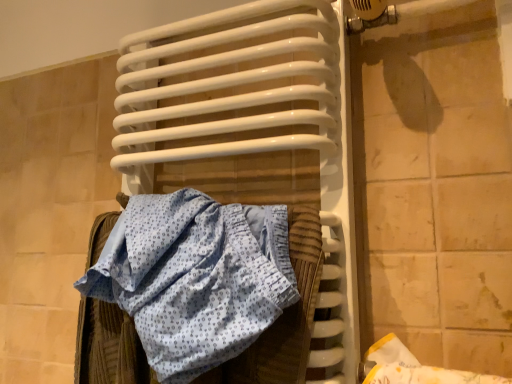
Identify the location of white glossy radiator at center. (251, 132).

What do you see at coordinates (251, 132) in the screenshot? I see `white glossy radiator at center` at bounding box center [251, 132].

In order to click on blue printed fabric at center in this screenshot , I will do `click(183, 285)`.

What do you see at coordinates (183, 285) in the screenshot? The width and height of the screenshot is (512, 384). I see `blue printed fabric at center` at bounding box center [183, 285].

What is the approximate height of blue printed fabric at center?

blue printed fabric at center is 11.73 inches in height.

What is the approximate width of blue printed fabric at center?

blue printed fabric at center is 6.60 inches in width.

I want to click on white glossy radiator at center, so pos(251,132).

Which object is positioned more to the right, white glossy radiator at center or blue printed fabric at center?

Positioned to the right is white glossy radiator at center.

Does white glossy radiator at center come behind blue printed fabric at center?

Yes.

Considering the points (195, 46) and (145, 284), which point is behind, point (195, 46) or point (145, 284)?

Point (195, 46)

From the image's perspective, is white glossy radiator at center under blue printed fabric at center?

No, from the image's perspective, white glossy radiator at center is not beneath blue printed fabric at center.

From a real-world perspective, who is located lower, white glossy radiator at center or blue printed fabric at center?

In real-world perspective, blue printed fabric at center is lower.

Which object is wider, white glossy radiator at center or blue printed fabric at center?

Wider between the two is blue printed fabric at center.

Is white glossy radiator at center taller than blue printed fabric at center?

Indeed, white glossy radiator at center has a greater height compared to blue printed fabric at center.

Based on the photo, considering the relative sizes of white glossy radiator at center and blue printed fabric at center in the image provided, is white glossy radiator at center bigger than blue printed fabric at center?

→ Yes, white glossy radiator at center is bigger than blue printed fabric at center.

Is white glossy radiator at center spatially inside blue printed fabric at center, or outside of it?

white glossy radiator at center is not inside blue printed fabric at center, it's outside.

Would you say white glossy radiator at center is a long distance from blue printed fabric at center?

white glossy radiator at center is actually quite close to blue printed fabric at center.

Is white glossy radiator at center oriented towards blue printed fabric at center?

Yes, white glossy radiator at center is aimed at blue printed fabric at center.

Looking at this image, how different are the orientations of white glossy radiator at center and blue printed fabric at center in degrees?

The angle between the facing direction of white glossy radiator at center and the facing direction of blue printed fabric at center is 0.000628 degrees.

Locate an element on the screen. Image resolution: width=512 pixels, height=384 pixels. towel below the white glossy radiator at center (from the image's perspective) is located at coordinates (183, 285).

Considering the relative positions of blue printed fabric at center and white glossy radiator at center in the image provided, is blue printed fabric at center to the left of white glossy radiator at center from the viewer's perspective?

Indeed, blue printed fabric at center is positioned on the left side of white glossy radiator at center.

Is blue printed fabric at center in front of or behind white glossy radiator at center in the image?

Visually, blue printed fabric at center is located in front of white glossy radiator at center.

Which is closer, (x=163, y=289) or (x=121, y=128)?

Point (x=163, y=289)

From the image's perspective, who appears lower, blue printed fabric at center or white glossy radiator at center?

blue printed fabric at center is shown below in the image.

From a real-world perspective, between blue printed fabric at center and white glossy radiator at center, who is vertically lower?

blue printed fabric at center.

Is blue printed fabric at center wider than white glossy radiator at center?

Correct, the width of blue printed fabric at center exceeds that of white glossy radiator at center.

Which of these two, blue printed fabric at center or white glossy radiator at center, stands shorter?

blue printed fabric at center.

Looking at the image, does blue printed fabric at center seem bigger or smaller compared to white glossy radiator at center?

blue printed fabric at center is smaller than white glossy radiator at center.

Is blue printed fabric at center spatially inside white glossy radiator at center, or outside of it?

blue printed fabric at center exists entirely within white glossy radiator at center.

Is there a large distance between blue printed fabric at center and white glossy radiator at center?

No, there isn't a large distance between blue printed fabric at center and white glossy radiator at center.

From the picture: Could you tell me if blue printed fabric at center is turned towards white glossy radiator at center?

No, blue printed fabric at center does not turn towards white glossy radiator at center.

How different are the orientations of blue printed fabric at center and white glossy radiator at center in degrees?

The facing directions of blue printed fabric at center and white glossy radiator at center are 0.000628 degrees apart.

Identify the location of towel on the left side of white glossy radiator at center. The width and height of the screenshot is (512, 384). (183, 285).

The image size is (512, 384). What are the coordinates of `towel on the left of white glossy radiator at center` in the screenshot? It's located at (183, 285).

Image resolution: width=512 pixels, height=384 pixels. Identify the location of towel in front of the white glossy radiator at center. (183, 285).